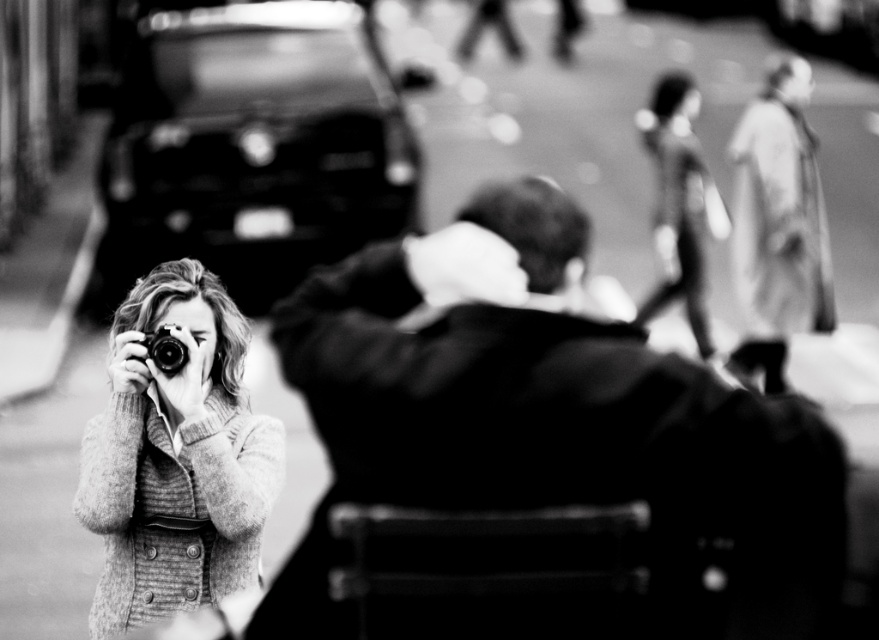
Is shiny black car at upper left taller than knitted sweater at left?

Yes.

Can you confirm if shiny black car at upper left is positioned below knitted sweater at left?

Actually, shiny black car at upper left is above knitted sweater at left.

Is point (171, 144) farther from viewer compared to point (218, 387)?

Yes, it is behind point (218, 387).

At what (x,y) coordinates should I click in order to perform the action: click on shiny black car at upper left. Please return your answer as a coordinate pair (x, y). The height and width of the screenshot is (640, 879). Looking at the image, I should click on (252, 147).

Which is more to the right, smooth leather jacket at center or metallic silver camera at center?

smooth leather jacket at center

Is the position of smooth leather jacket at center less distant than that of metallic silver camera at center?

Yes, smooth leather jacket at center is closer to the viewer.

The image size is (879, 640). What do you see at coordinates (551, 460) in the screenshot? I see `smooth leather jacket at center` at bounding box center [551, 460].

Locate an element on the screen. This screenshot has height=640, width=879. smooth leather jacket at center is located at coordinates (551, 460).

Which is behind, point (92, 308) or point (154, 333)?

Point (92, 308)

Which is in front, point (160, 93) or point (175, 369)?

Point (175, 369)

Identify the location of shiny black car at upper left. The width and height of the screenshot is (879, 640). (252, 147).